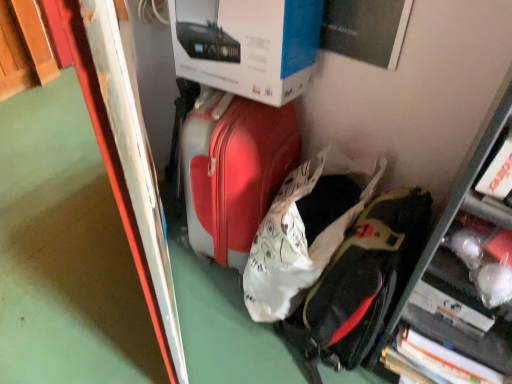
What do you see at coordinates (135, 178) in the screenshot? I see `metallic silver bulletin board at left` at bounding box center [135, 178].

At what (x,y) coordinates should I click in order to perform the action: click on black matte backpack at lower right. Please return your answer as a coordinate pair (x, y). The image size is (512, 384). Looking at the image, I should click on (360, 283).

Between white cardboard box at upper center and matte red suitcase at center, which one has more height?

With more height is matte red suitcase at center.

Locate an element on the screen. The height and width of the screenshot is (384, 512). luggage in front of the white cardboard box at upper center is located at coordinates (300, 236).

Which object is wider, white cardboard box at upper center or matte red suitcase at center?

matte red suitcase at center is wider.

Visually, is white cardboard box at upper center positioned to the left or to the right of matte red suitcase at center?

white cardboard box at upper center is to the left of matte red suitcase at center.

Considering the sizes of objects matte red suitcase at center and metallic silver bulletin board at left in the image provided, who is shorter, matte red suitcase at center or metallic silver bulletin board at left?

Standing shorter between the two is matte red suitcase at center.

Does point (340, 162) come farther from viewer compared to point (128, 162)?

Yes, it is behind point (128, 162).

Locate an element on the screen. luggage behind the metallic silver bulletin board at left is located at coordinates (300, 236).

Between white cardboard box at upper center and black matte backpack at lower right, which one has more height?

black matte backpack at lower right.

Is white cardboard box at upper center facing away from black matte backpack at lower right?

white cardboard box at upper center does not have its back to black matte backpack at lower right.

Considering the points (239, 86) and (314, 351), which point is in front, point (239, 86) or point (314, 351)?

Point (239, 86)

Between white cardboard box at upper center and black matte backpack at lower right, which one has larger size?

Bigger between the two is black matte backpack at lower right.

In the scene shown: Is matte red suitcase at center far from black matte backpack at lower right?

matte red suitcase at center is actually quite close to black matte backpack at lower right.

In the image, is matte red suitcase at center positioned in front of or behind black matte backpack at lower right?

matte red suitcase at center is behind black matte backpack at lower right.

From the image's perspective, is matte red suitcase at center above or below black matte backpack at lower right?

Based on their image positions, matte red suitcase at center is located above black matte backpack at lower right.

In the scene shown: Which of these two, matte red suitcase at center or black matte backpack at lower right, is bigger?

Bigger between the two is matte red suitcase at center.

From a real-world perspective, which object rests below the other?

black matte backpack at lower right is physically lower.

How many degrees apart are the facing directions of black matte backpack at lower right and metallic silver bulletin board at left?

The facing directions of black matte backpack at lower right and metallic silver bulletin board at left are 140 degrees apart.

Where is `backpack behind the metallic silver bulletin board at left`? Image resolution: width=512 pixels, height=384 pixels. backpack behind the metallic silver bulletin board at left is located at coordinates (360, 283).

This screenshot has height=384, width=512. What are the coordinates of `bulletin board in front of the matte red suitcase at center` in the screenshot? It's located at (135, 178).

How many degrees apart are the facing directions of metallic silver bulletin board at left and matte red suitcase at center?

metallic silver bulletin board at left and matte red suitcase at center are facing 140 degrees away from each other.

From the picture: Is metallic silver bulletin board at left far away from matte red suitcase at center?

Actually, metallic silver bulletin board at left and matte red suitcase at center are a little close together.

In the image, is metallic silver bulletin board at left on the left side or the right side of matte red suitcase at center?

metallic silver bulletin board at left is positioned on matte red suitcase at center's left side.

From a real-world perspective, is metallic silver bulletin board at left physically above white cardboard box at upper center?

No.

Based on the photo, which object is wider, metallic silver bulletin board at left or white cardboard box at upper center?

Wider between the two is white cardboard box at upper center.

Would you say metallic silver bulletin board at left is inside or outside white cardboard box at upper center?

metallic silver bulletin board at left is not inside white cardboard box at upper center, it's outside.

Looking at this image, how different are the orientations of metallic silver bulletin board at left and white cardboard box at upper center in degrees?

metallic silver bulletin board at left and white cardboard box at upper center are facing 140 degrees away from each other.

At what (x,y) coordinates should I click in order to perform the action: click on luggage lying below the white cardboard box at upper center (from the image's perspective). Please return your answer as a coordinate pair (x, y). This screenshot has width=512, height=384. Looking at the image, I should click on (300, 236).

Identify the location of bulletin board in front of the matte red suitcase at center. (135, 178).

From the picture: Based on their spatial positions, is matte red suitcase at center or black matte backpack at lower right closer to metallic silver bulletin board at left?

The object closer to metallic silver bulletin board at left is matte red suitcase at center.

Which object lies further to the anchor point matte red suitcase at center, black matte backpack at lower right or metallic silver bulletin board at left?

The object further to matte red suitcase at center is metallic silver bulletin board at left.

Looking at the image, which one is located closer to metallic silver bulletin board at left, white cardboard box at upper center or matte red suitcase at center?

white cardboard box at upper center.

Estimate the real-world distances between objects in this image. Which object is closer to matte red suitcase at center, white cardboard box at upper center or black matte backpack at lower right?

Based on the image, black matte backpack at lower right appears to be nearer to matte red suitcase at center.

From the image, which object appears to be nearer to black matte backpack at lower right, matte red suitcase at center or white cardboard box at upper center?

Based on the image, matte red suitcase at center appears to be nearer to black matte backpack at lower right.

Estimate the real-world distances between objects in this image. Which object is closer to white cardboard box at upper center, matte red suitcase at center or metallic silver bulletin board at left?

metallic silver bulletin board at left lies closer to white cardboard box at upper center than the other object.

Estimate the real-world distances between objects in this image. Which object is further from matte red suitcase at center, black matte backpack at lower right or white cardboard box at upper center?

The object further to matte red suitcase at center is white cardboard box at upper center.

Estimate the real-world distances between objects in this image. Which object is further from metallic silver bulletin board at left, white cardboard box at upper center or black matte backpack at lower right?

black matte backpack at lower right is further to metallic silver bulletin board at left.

Find the location of a particular element. This screenshot has height=384, width=512. bulletin board between white cardboard box at upper center and black matte backpack at lower right in the up-down direction is located at coordinates (135, 178).

Find the location of a particular element. The height and width of the screenshot is (384, 512). luggage that lies between white cardboard box at upper center and black matte backpack at lower right from top to bottom is located at coordinates (300, 236).

The width and height of the screenshot is (512, 384). I want to click on luggage positioned between metallic silver bulletin board at left and white cardboard box at upper center from near to far, so click(x=300, y=236).

The width and height of the screenshot is (512, 384). Find the location of `luggage between metallic silver bulletin board at left and black matte backpack at lower right in the horizontal direction`. luggage between metallic silver bulletin board at left and black matte backpack at lower right in the horizontal direction is located at coordinates (300, 236).